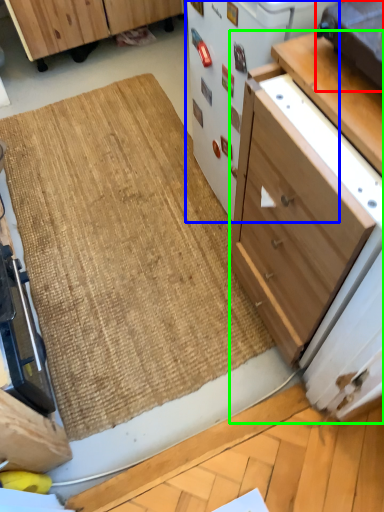
Question: Based on their relative distances, which object is farther from appliance (highlighted by a red box)? Choose from appliance (highlighted by a blue box) and cabinetry (highlighted by a green box).

Choices:
 (A) appliance
 (B) cabinetry

Answer: (A)